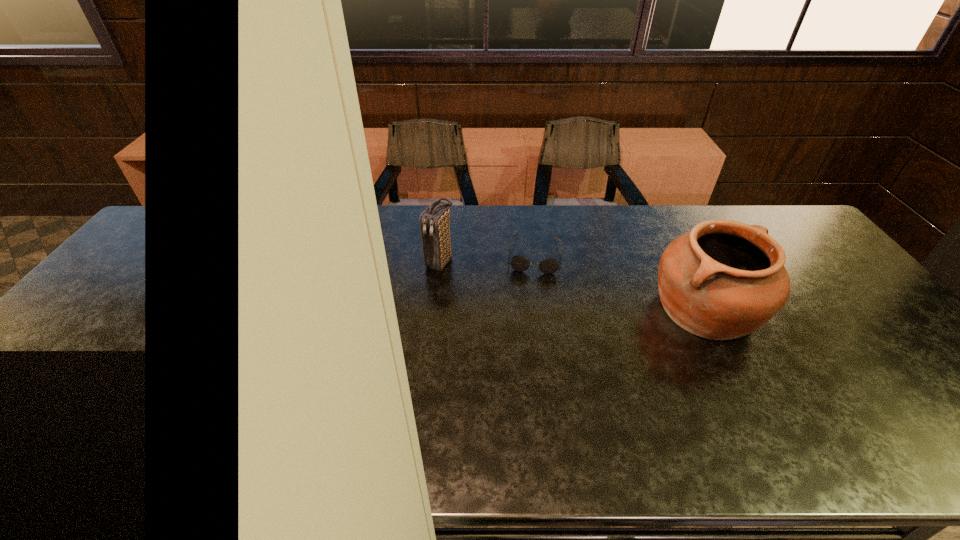
Identify the location of vacant area between the pottery and the sunglasses. (619, 282).

What are the coordinates of `the closest object relative to the second object from left to right` in the screenshot? It's located at (435, 221).

Identify the location of object that is the closest to the sunglasses. (435, 221).